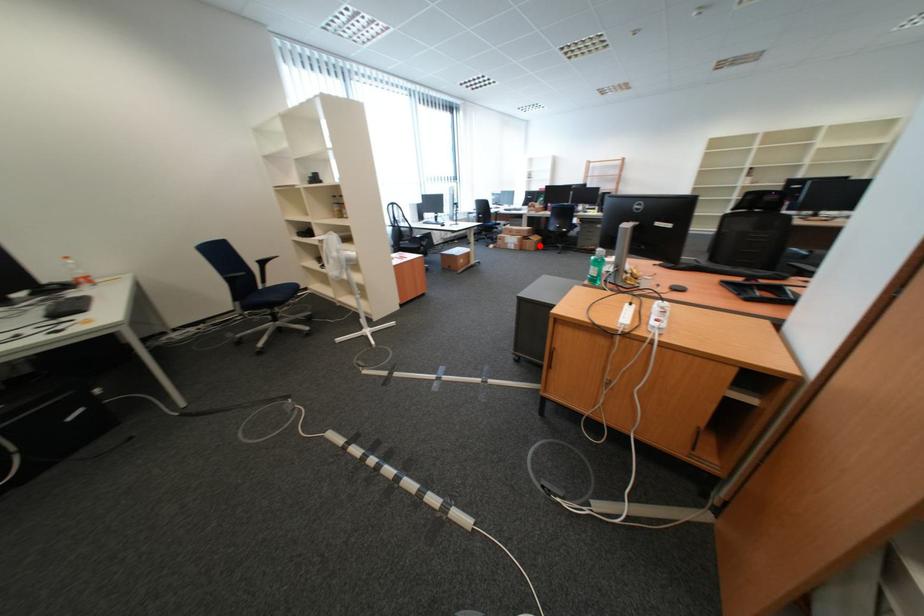
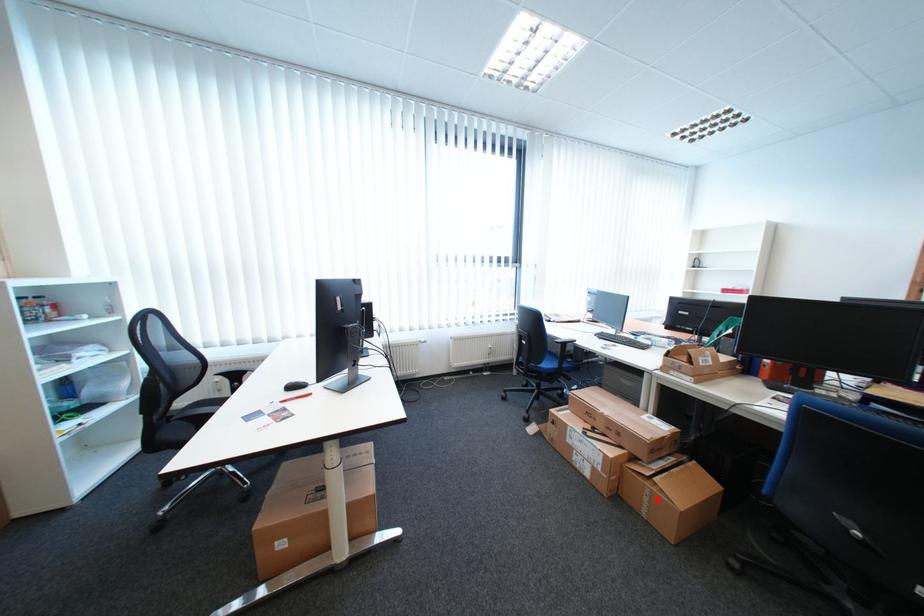
I am providing you with two images of the same scene from different viewpoints. A red point is marked on the first image and another point is marked on the second image. Are the points marked in image1 and image2 representing the same 3D position?

Yes